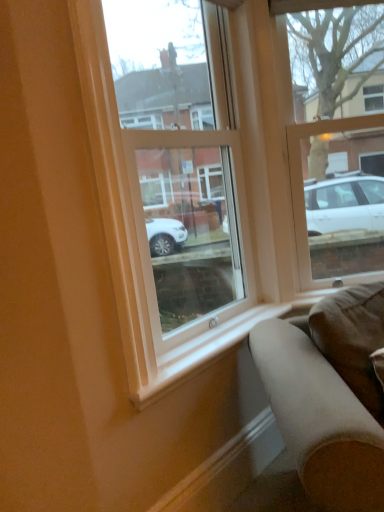
Question: Looking at their shapes, would you say transparent glass window at center, which appears as the 1th window when viewed from the left, is wider or thinner than brown suede pillow at lower right?

Choices:
 (A) wide
 (B) thin

Answer: (B)

Question: Considering the relative positions of transparent glass window at center, which appears as the 1th window when viewed from the left, and brown suede pillow at lower right in the image provided, is transparent glass window at center, which appears as the 1th window when viewed from the left, to the left or to the right of brown suede pillow at lower right?

Choices:
 (A) left
 (B) right

Answer: (A)

Question: Considering the real-world distances, which object is farthest from the brown suede pillow at lower right?

Choices:
 (A) white smooth window sill at lower center
 (B) suede-like brown couch at lower right
 (C) smooth wood curb at lower center
 (D) transparent glass window at center, placed as the 2th window when sorted from right to left
 (E) clear glass window at upper right, the first window viewed from the right

Answer: (E)

Question: Based on their relative distances, which object is farther from the suede-like brown couch at lower right?

Choices:
 (A) transparent glass window at center, placed as the 2th window when sorted from right to left
 (B) clear glass window at upper right, the first window viewed from the right
 (C) smooth wood curb at lower center
 (D) white smooth window sill at lower center
 (E) brown suede pillow at lower right

Answer: (B)